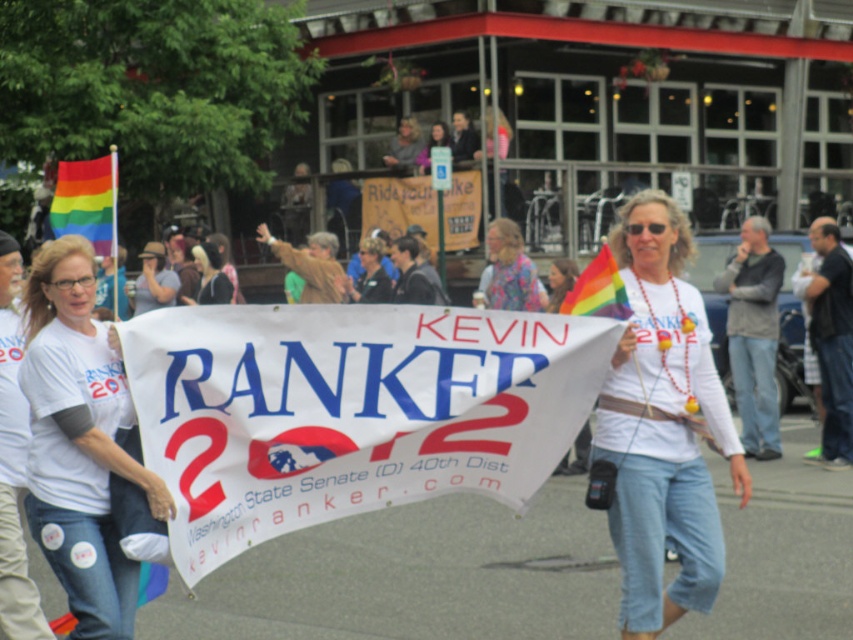
Question: Can you confirm if rainbow fabric flag at center is thinner than blonde hair at center?

Choices:
 (A) yes
 (B) no

Answer: (B)

Question: Is white paper banner at center behind white t-shirt at left?

Choices:
 (A) yes
 (B) no

Answer: (B)

Question: Which object appears closest to the camera in this image?

Choices:
 (A) white t-shirt at left
 (B) white matte t-shirt at center
 (C) floral fabric shirt at center
 (D) white paper banner at center

Answer: (D)

Question: Among these points, which one is farthest from the camera?

Choices:
 (A) (50, 502)
 (B) (598, 300)
 (C) (653, 624)
 (D) (361, 449)

Answer: (B)

Question: Is white paper banner at center below blonde hair at center?

Choices:
 (A) no
 (B) yes

Answer: (B)

Question: Which of the following is the closest to the observer?

Choices:
 (A) white paper banner at center
 (B) blonde hair at center
 (C) rainbow fabric flag at upper left

Answer: (A)